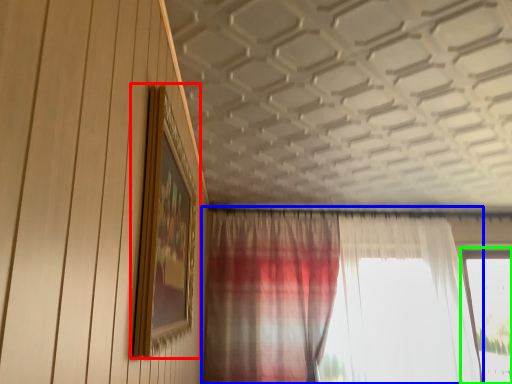
Question: Considering the real-world distances, which object is closest to picture frame (highlighted by a red box)? curtain (highlighted by a blue box) or window (highlighted by a green box).

Choices:
 (A) curtain
 (B) window

Answer: (A)